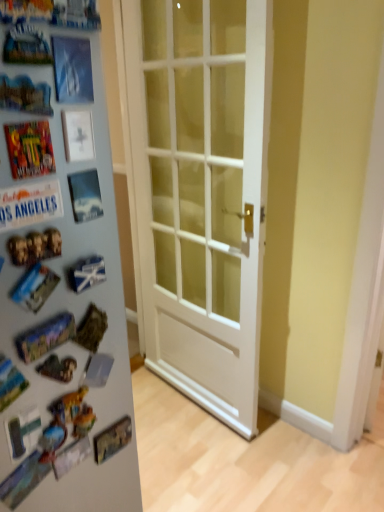
Question: Is shiny metallic comic book at left inside or outside of white glossy refrigerator at left?

Choices:
 (A) inside
 (B) outside

Answer: (B)

Question: From the image's perspective, is shiny metallic comic book at left positioned above or below white glossy refrigerator at left?

Choices:
 (A) below
 (B) above

Answer: (B)

Question: Which is farther from the white glossy refrigerator at left?

Choices:
 (A) shiny metallic comic book at left
 (B) white glossy door at center

Answer: (B)

Question: Estimate the real-world distances between objects in this image. Which object is closer to the white glossy door at center?

Choices:
 (A) white glossy refrigerator at left
 (B) shiny metallic comic book at left

Answer: (A)